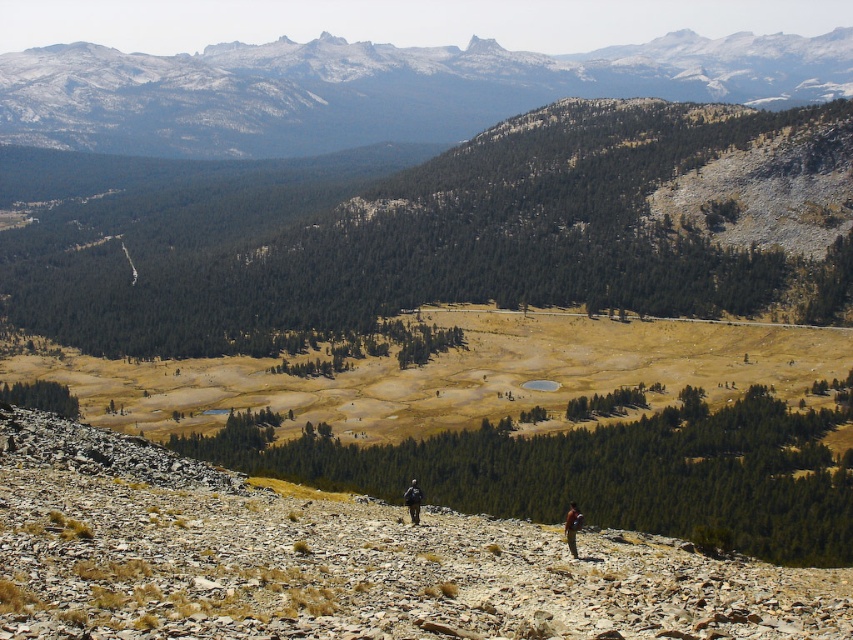
Question: Which point is farther to the camera?

Choices:
 (A) brown leather jacket at lower center
 (B) black fabric backpack at center

Answer: (B)

Question: Does snowy granite mountain at upper center come behind brown leather jacket at lower center?

Choices:
 (A) yes
 (B) no

Answer: (A)

Question: Observing the image, what is the correct spatial positioning of brown leather jacket at lower center in reference to black fabric backpack at center?

Choices:
 (A) left
 (B) right

Answer: (B)

Question: Is brown leather jacket at lower center below black fabric backpack at center?

Choices:
 (A) no
 (B) yes

Answer: (B)

Question: Which of the following is the closest to the observer?

Choices:
 (A) black fabric backpack at center
 (B) brown leather jacket at lower center

Answer: (B)

Question: Which of these objects is positioned closest to the black fabric backpack at center?

Choices:
 (A) snowy granite mountain at upper center
 (B) brown leather jacket at lower center

Answer: (B)